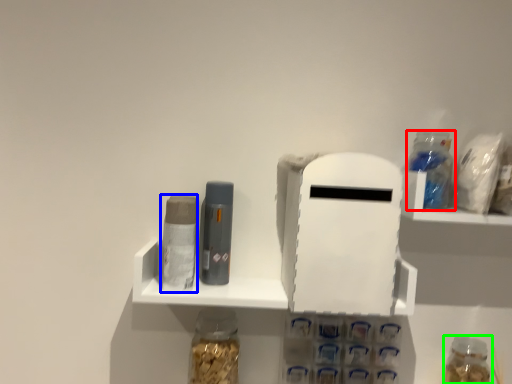
Question: Which is nearer to the bottle (highlighted by a red box)? toiletry (highlighted by a blue box) or bottle (highlighted by a green box).

Choices:
 (A) toiletry
 (B) bottle

Answer: (B)